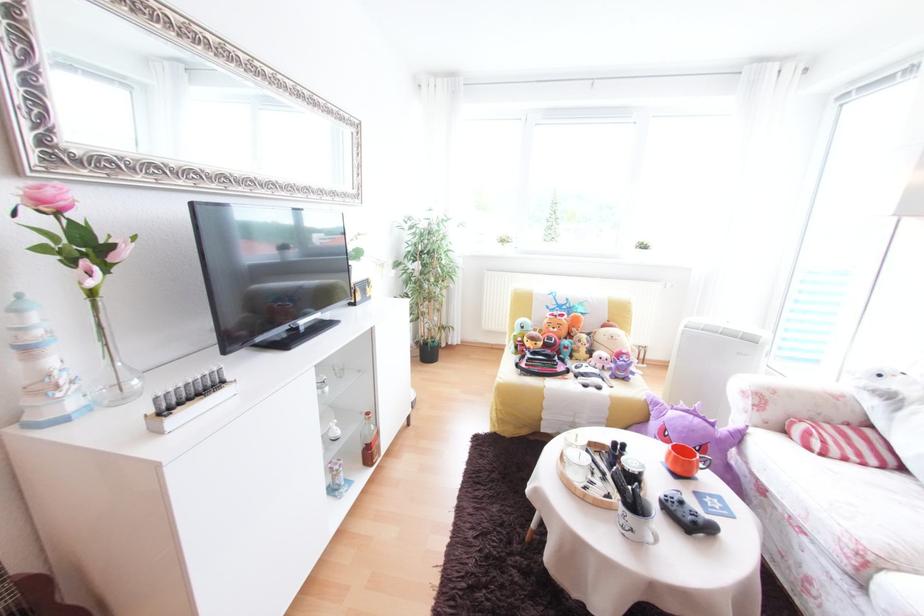
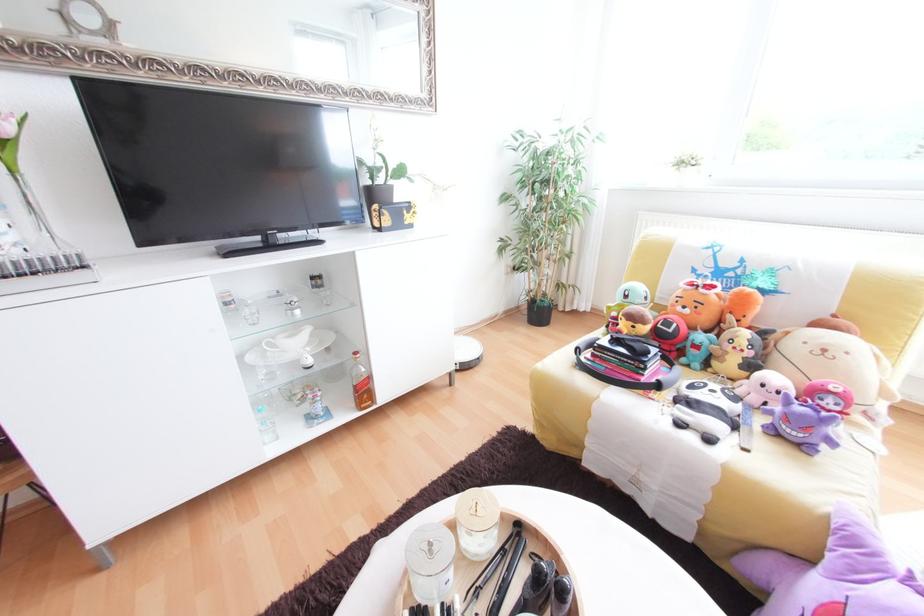
Find the pixel in the second image that matches point (608, 389) in the first image.

(718, 440)